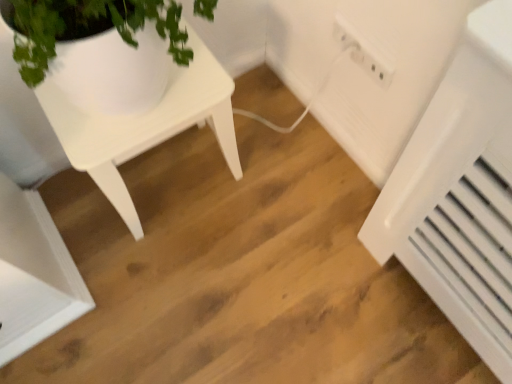
Question: Considering the positions of white matte table at upper left and white plastic radiator at lower right in the image, is white matte table at upper left bigger or smaller than white plastic radiator at lower right?

Choices:
 (A) big
 (B) small

Answer: (A)

Question: Based on their positions, is white matte table at upper left located to the left or right of white plastic radiator at lower right?

Choices:
 (A) right
 (B) left

Answer: (B)

Question: Which is farther from the white matte table at upper left?

Choices:
 (A) white plastic radiator at lower right
 (B) white plastic electric outlet at upper right

Answer: (A)

Question: Which object is positioned closest to the white plastic electric outlet at upper right?

Choices:
 (A) white plastic radiator at lower right
 (B) white matte table at upper left

Answer: (A)